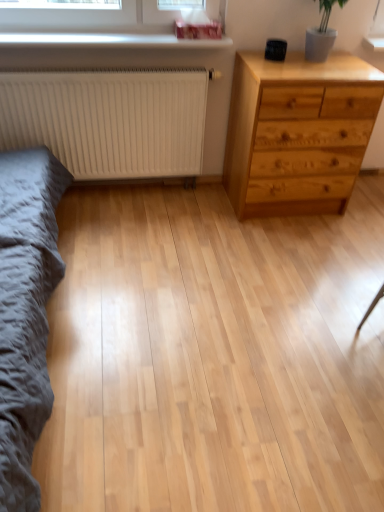
Question: Considering the relative sizes of white matte radiator at left and dark gray fabric bed frame at left in the image provided, is white matte radiator at left taller than dark gray fabric bed frame at left?

Choices:
 (A) no
 (B) yes

Answer: (A)

Question: Is white matte radiator at left far from dark gray fabric bed frame at left?

Choices:
 (A) yes
 (B) no

Answer: (B)

Question: Would you say white matte radiator at left is outside dark gray fabric bed frame at left?

Choices:
 (A) no
 (B) yes

Answer: (B)

Question: From a real-world perspective, is white matte radiator at left positioned under dark gray fabric bed frame at left based on gravity?

Choices:
 (A) yes
 (B) no

Answer: (A)

Question: From the image's perspective, does white matte radiator at left appear higher than dark gray fabric bed frame at left?

Choices:
 (A) no
 (B) yes

Answer: (B)

Question: Considering the positions of dark gray fabric bed frame at left and white matte radiator at left in the image, is dark gray fabric bed frame at left wider or thinner than white matte radiator at left?

Choices:
 (A) thin
 (B) wide

Answer: (B)

Question: Is point (31, 162) positioned closer to the camera than point (167, 128)?

Choices:
 (A) closer
 (B) farther

Answer: (A)

Question: Is dark gray fabric bed frame at left situated inside white matte radiator at left or outside?

Choices:
 (A) inside
 (B) outside

Answer: (B)

Question: In the image, is dark gray fabric bed frame at left on the left side or the right side of white matte radiator at left?

Choices:
 (A) right
 (B) left

Answer: (B)

Question: From the image's perspective, is dark gray fabric bed frame at left positioned above or below natural wood chest of drawers at right?

Choices:
 (A) below
 (B) above

Answer: (A)

Question: Considering their positions, is dark gray fabric bed frame at left located in front of or behind natural wood chest of drawers at right?

Choices:
 (A) front
 (B) behind

Answer: (A)

Question: From a real-world perspective, is dark gray fabric bed frame at left physically located above or below natural wood chest of drawers at right?

Choices:
 (A) above
 (B) below

Answer: (A)

Question: Which is correct: dark gray fabric bed frame at left is inside natural wood chest of drawers at right, or outside of it?

Choices:
 (A) outside
 (B) inside

Answer: (A)

Question: Considering the positions of white glossy window sill at upper center and natural wood chest of drawers at right in the image, is white glossy window sill at upper center wider or thinner than natural wood chest of drawers at right?

Choices:
 (A) thin
 (B) wide

Answer: (A)

Question: In terms of height, does white glossy window sill at upper center look taller or shorter compared to natural wood chest of drawers at right?

Choices:
 (A) short
 (B) tall

Answer: (A)